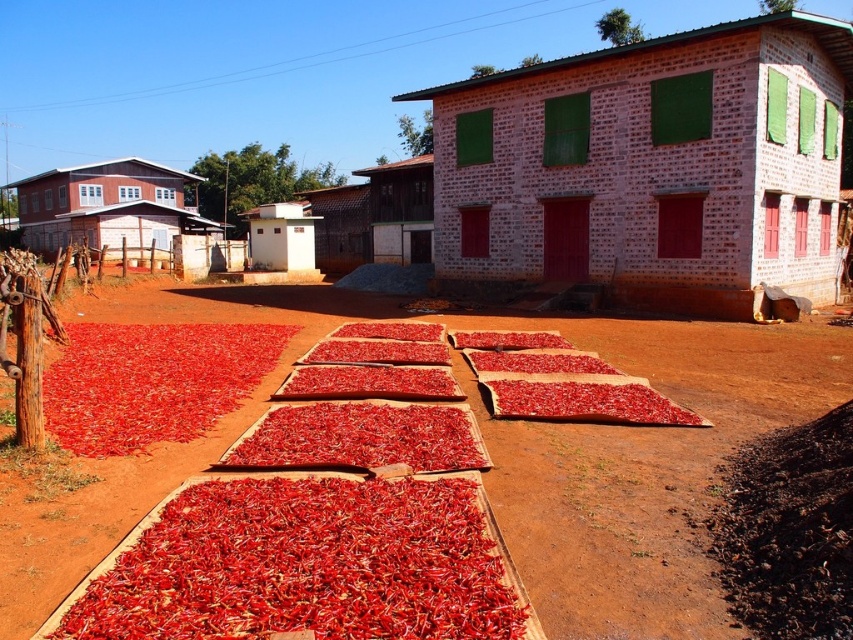
Is red dirt field at center bigger than white brick hut at center?

Indeed, red dirt field at center has a larger size compared to white brick hut at center.

Can you confirm if red dirt field at center is positioned to the right of white brick hut at center?

Indeed, red dirt field at center is positioned on the right side of white brick hut at center.

Does point (689, 536) lie behind point (309, 259)?

That is False.

At what (x,y) coordinates should I click in order to perform the action: click on red dirt field at center. Please return your answer as a coordinate pair (x, y). Looking at the image, I should click on (489, 454).

Is brick wall house at center to the left of matte wood hut at left from the viewer's perspective?

No, brick wall house at center is not to the left of matte wood hut at left.

Between point (433, 122) and point (55, 209), which one is positioned behind?

Point (55, 209)

Where is `brick wall house at center`? brick wall house at center is located at coordinates (650, 168).

Can you confirm if red dirt field at center is positioned to the right of brown wooden hut at center?

Indeed, red dirt field at center is positioned on the right side of brown wooden hut at center.

Who is positioned more to the right, red dirt field at center or brown wooden hut at center?

From the viewer's perspective, red dirt field at center appears more on the right side.

Is point (576, 486) closer to viewer compared to point (335, 234)?

Yes, point (576, 486) is in front of point (335, 234).

Identify the location of red dirt field at center. (489, 454).